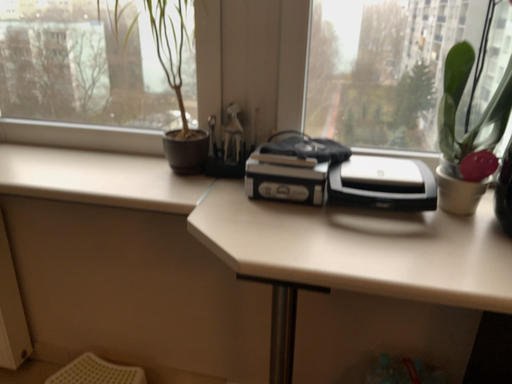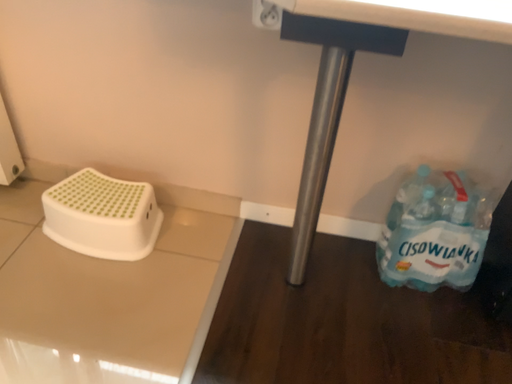
Question: Which way did the camera rotate in the video?

Choices:
 (A) rotated downward
 (B) rotated upward

Answer: (A)